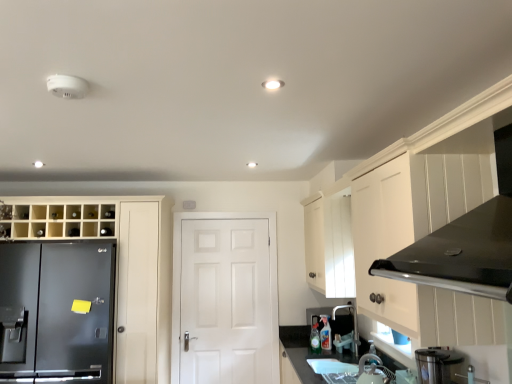
Question: From a real-world perspective, is white matte door at center positioned under smooth granite countertop at lower center based on gravity?

Choices:
 (A) yes
 (B) no

Answer: (B)

Question: Is white matte door at center far away from smooth granite countertop at lower center?

Choices:
 (A) yes
 (B) no

Answer: (B)

Question: Is smooth granite countertop at lower center completely or partially inside white matte door at center?

Choices:
 (A) no
 (B) yes

Answer: (A)

Question: Considering the relative sizes of white matte door at center and smooth granite countertop at lower center in the image provided, is white matte door at center smaller than smooth granite countertop at lower center?

Choices:
 (A) yes
 (B) no

Answer: (A)

Question: Is white matte door at center at the right side of smooth granite countertop at lower center?

Choices:
 (A) no
 (B) yes

Answer: (A)

Question: Is white matte door at center shorter than smooth granite countertop at lower center?

Choices:
 (A) no
 (B) yes

Answer: (A)

Question: Does smooth granite countertop at lower center lie behind matte black refrigerator at left?

Choices:
 (A) yes
 (B) no

Answer: (B)

Question: Would you say smooth granite countertop at lower center is outside matte black refrigerator at left?

Choices:
 (A) yes
 (B) no

Answer: (A)

Question: Considering the relative sizes of smooth granite countertop at lower center and matte black refrigerator at left in the image provided, is smooth granite countertop at lower center shorter than matte black refrigerator at left?

Choices:
 (A) yes
 (B) no

Answer: (A)

Question: Considering the relative positions of smooth granite countertop at lower center and matte black refrigerator at left in the image provided, is smooth granite countertop at lower center to the left of matte black refrigerator at left from the viewer's perspective?

Choices:
 (A) yes
 (B) no

Answer: (B)

Question: Is smooth granite countertop at lower center positioned far away from matte black refrigerator at left?

Choices:
 (A) no
 (B) yes

Answer: (B)

Question: Considering the relative sizes of smooth granite countertop at lower center and matte black refrigerator at left in the image provided, is smooth granite countertop at lower center bigger than matte black refrigerator at left?

Choices:
 (A) yes
 (B) no

Answer: (B)

Question: Does stainless steel blender at lower right, the second appliance when ordered from bottom to top, have a greater height compared to smooth granite countertop at lower center?

Choices:
 (A) yes
 (B) no

Answer: (B)